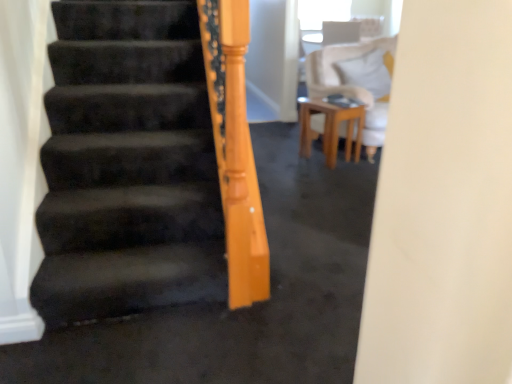
Question: Is white soft pillow at upper right in contact with wooden table at center?

Choices:
 (A) no
 (B) yes

Answer: (A)

Question: Are white soft pillow at upper right and wooden table at center located far from each other?

Choices:
 (A) yes
 (B) no

Answer: (B)

Question: Is white soft pillow at upper right closer to the viewer compared to wooden table at center?

Choices:
 (A) no
 (B) yes

Answer: (A)

Question: Can you confirm if white soft pillow at upper right is smaller than wooden table at center?

Choices:
 (A) yes
 (B) no

Answer: (B)

Question: From a real-world perspective, is white soft pillow at upper right physically below wooden table at center?

Choices:
 (A) yes
 (B) no

Answer: (B)

Question: Can you confirm if white soft pillow at upper right is thinner than wooden table at center?

Choices:
 (A) yes
 (B) no

Answer: (A)

Question: Is transparent plastic window screen at upper center positioned before wooden table at center?

Choices:
 (A) no
 (B) yes

Answer: (A)

Question: From the image's perspective, is transparent plastic window screen at upper center on wooden table at center?

Choices:
 (A) no
 (B) yes

Answer: (B)

Question: Could wooden table at center be considered to be inside transparent plastic window screen at upper center?

Choices:
 (A) no
 (B) yes

Answer: (A)

Question: Considering the relative sizes of transparent plastic window screen at upper center and wooden table at center in the image provided, is transparent plastic window screen at upper center taller than wooden table at center?

Choices:
 (A) yes
 (B) no

Answer: (B)

Question: Does transparent plastic window screen at upper center appear on the right side of wooden table at center?

Choices:
 (A) no
 (B) yes

Answer: (B)

Question: Is transparent plastic window screen at upper center shorter than wooden table at center?

Choices:
 (A) no
 (B) yes

Answer: (B)

Question: Could you tell me if white soft pillow at upper right is turned towards transparent plastic window screen at upper center?

Choices:
 (A) yes
 (B) no

Answer: (B)